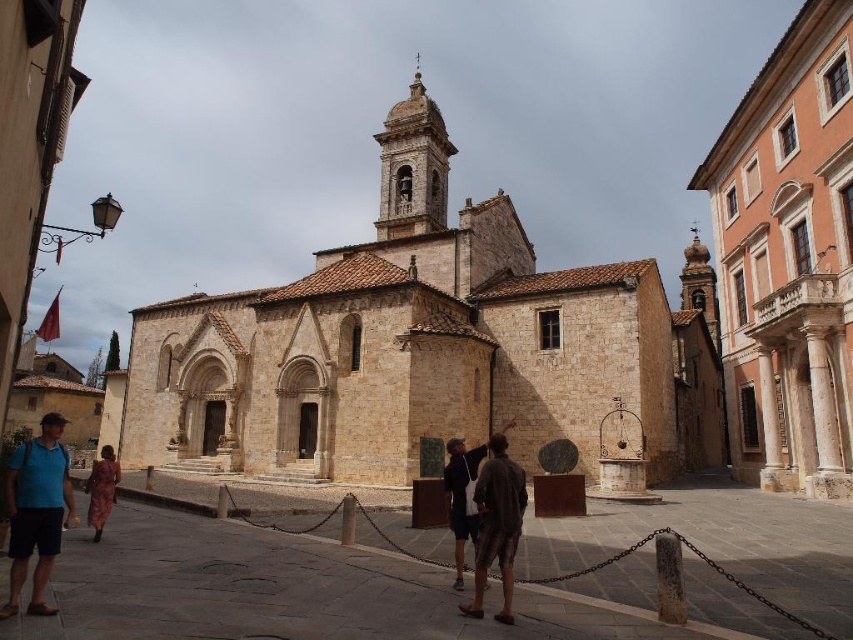
Is beige stone church at center taller than blue fabric shirt at lower left?

Yes, beige stone church at center is taller than blue fabric shirt at lower left.

Which is below, beige stone church at center or blue fabric shirt at lower left?

blue fabric shirt at lower left

Who is more distant from viewer, (469, 316) or (33, 490)?

Answer: The point (469, 316) is more distant.

Where is `beige stone church at center`? The width and height of the screenshot is (853, 640). beige stone church at center is located at coordinates [428, 348].

Is point (817, 268) in front of point (88, 484)?

No.

Is light orange stone building at right closer to the viewer compared to leather coat at lower left?

That is False.

The image size is (853, 640). In order to click on light orange stone building at right in this screenshot , I will do `click(788, 259)`.

Does blue fabric shirt at lower left have a larger size compared to brown textured clothing at center?

Correct, blue fabric shirt at lower left is larger in size than brown textured clothing at center.

Does blue fabric shirt at lower left appear on the right side of brown textured clothing at center?

In fact, blue fabric shirt at lower left is to the left of brown textured clothing at center.

Which is in front, point (4, 608) or point (474, 612)?

Point (4, 608)

Where is `blue fabric shirt at lower left`? The image size is (853, 640). blue fabric shirt at lower left is located at coordinates (36, 512).